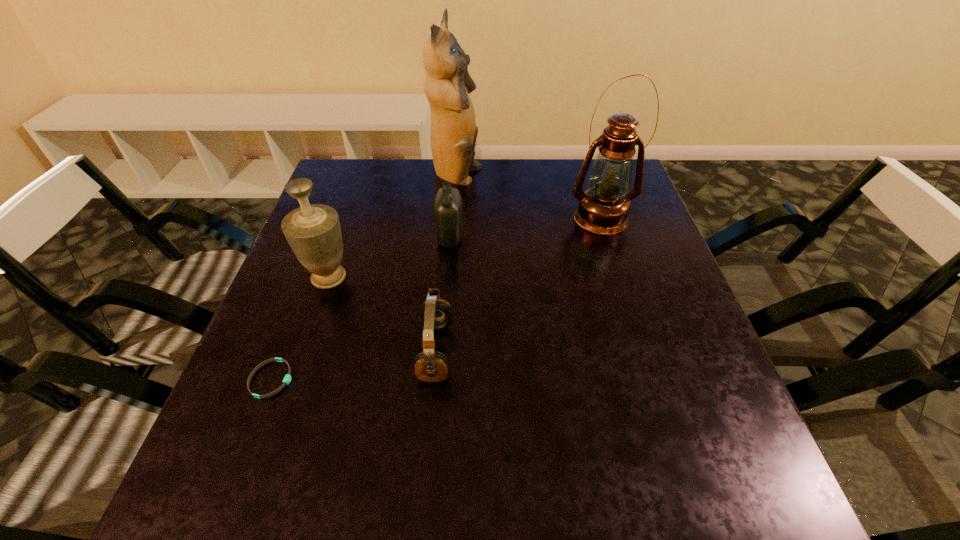
Image resolution: width=960 pixels, height=540 pixels. Identify the location of cat. (453, 133).

This screenshot has width=960, height=540. I want to click on the rightmost object, so click(x=603, y=208).

Find the location of `the fifth shortest object`. the fifth shortest object is located at coordinates (603, 208).

Image resolution: width=960 pixels, height=540 pixels. I want to click on urn, so click(x=313, y=231).

Locate an element on the screen. the third tallest object is located at coordinates (313, 231).

Identify the location of bottle. (447, 206).

Locate an element on the screen. Image resolution: width=960 pixels, height=540 pixels. headset is located at coordinates (430, 365).

Locate an element on the screen. Image resolution: width=960 pixels, height=540 pixels. the shortest object is located at coordinates (287, 378).

You are a GUI agent. You are given a task and a screenshot of the screen. Output one action in this format:
    pyautogui.click(x=<x>, y=<y>)
    Task: Click on the free space located 0.280m on the face of the farthest object
    
    Given the screenshot: What is the action you would take?
    pyautogui.click(x=576, y=176)

The width and height of the screenshot is (960, 540). I want to click on free spot located 0.140m on the back of the rightmost object, so click(x=588, y=174).